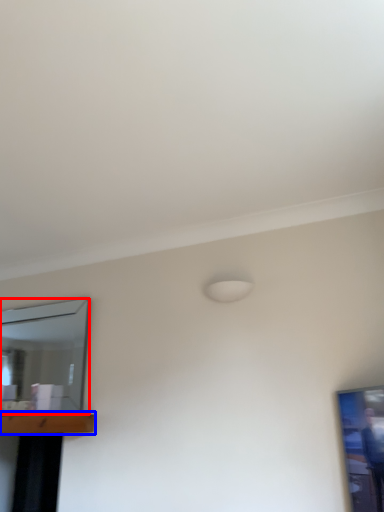
Question: Which object is closer to the camera taking this photo, mirror (highlighted by a red box) or table (highlighted by a blue box)?

Choices:
 (A) mirror
 (B) table

Answer: (B)